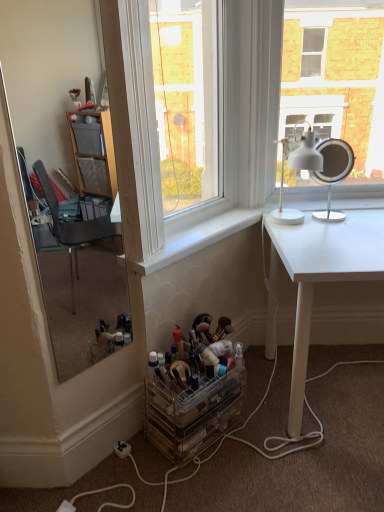
You are a GUI agent. You are given a task and a screenshot of the screen. Output one action in this format:
    pyautogui.click(x=<x>, y=<y>)
    Task: Click on the free location to the right of clear acrylic makeup organizer at lower center
    
    Given the screenshot: What is the action you would take?
    pyautogui.click(x=268, y=431)